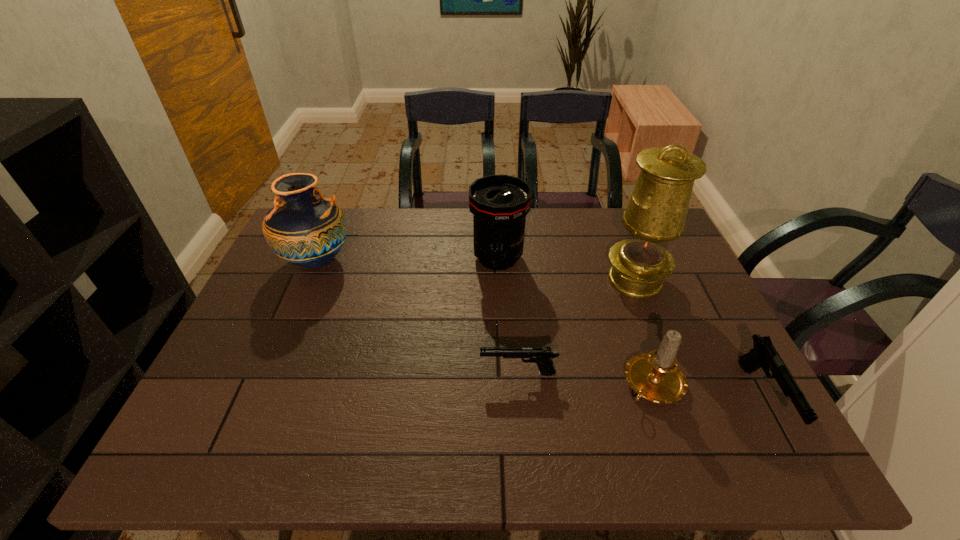
Where is `free space located 0.280m at the aiming end of the left gun`? free space located 0.280m at the aiming end of the left gun is located at coordinates (362, 373).

The height and width of the screenshot is (540, 960). I want to click on free point located on the left of the fourth shortest object, so click(444, 258).

I want to click on vacant space located on the left of the oil lamp, so click(x=505, y=280).

Where is `free space located 0.060m on the back of the leftmost object`? The image size is (960, 540). free space located 0.060m on the back of the leftmost object is located at coordinates pos(330,228).

This screenshot has height=540, width=960. Identify the location of free space located on the left of the fourth tallest object. (450, 384).

This screenshot has height=540, width=960. Find the location of `telephoto lens that is at the far edge`. telephoto lens that is at the far edge is located at coordinates (499, 203).

At what (x,y) coordinates should I click in order to perform the action: click on pottery situated at the far edge. Please return your answer as a coordinate pair (x, y). Looking at the image, I should click on (303, 228).

In order to click on gun that is at the near edge in this screenshot , I will do `click(764, 354)`.

Image resolution: width=960 pixels, height=540 pixels. What are the coordinates of `candle at the near edge` in the screenshot? It's located at (655, 376).

At what (x,y) coordinates should I click in order to perform the action: click on object situated at the left edge. Please return your answer as a coordinate pair (x, y). The image size is (960, 540). Looking at the image, I should click on (303, 228).